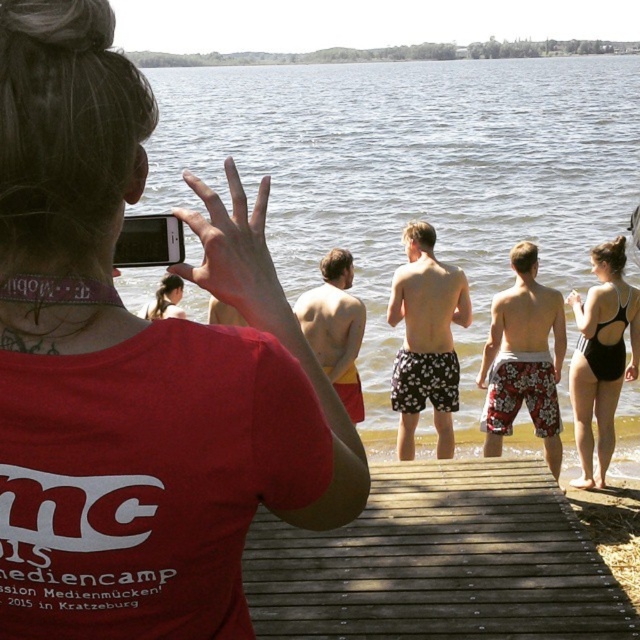
You are a photographer trying to capture a photo of the dark brown wooden dock at center and the black swimsuit at right. Based on their positions, which object is closer to the camera?

The dark brown wooden dock at center is below the black swimsuit at right, so the black swimsuit at right is closer to the camera.